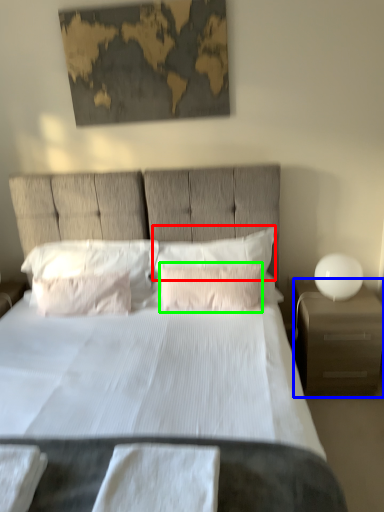
Question: Based on their relative distances, which object is nearer to pillow (highlighted by a red box)? Choose from nightstand (highlighted by a blue box) and pillow (highlighted by a green box).

Choices:
 (A) nightstand
 (B) pillow

Answer: (B)